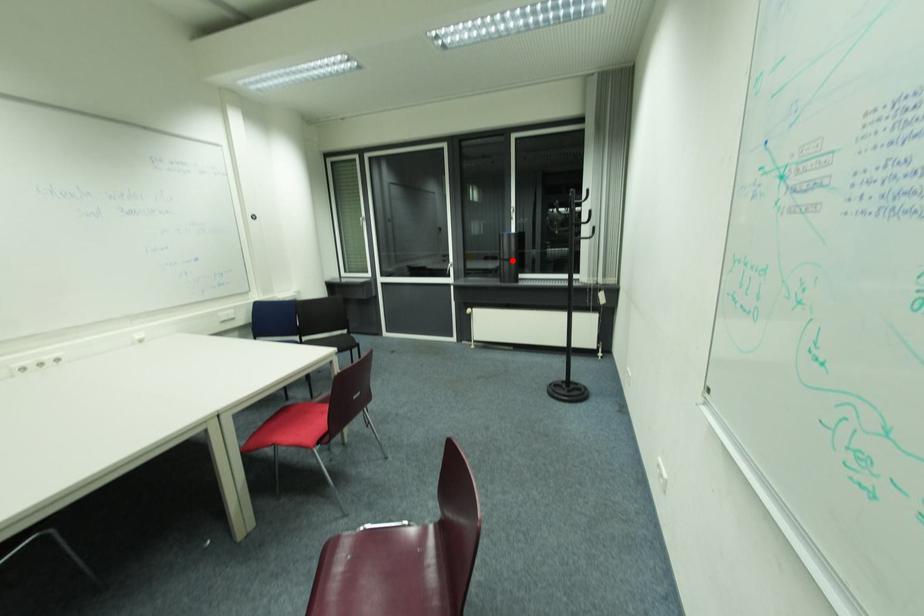
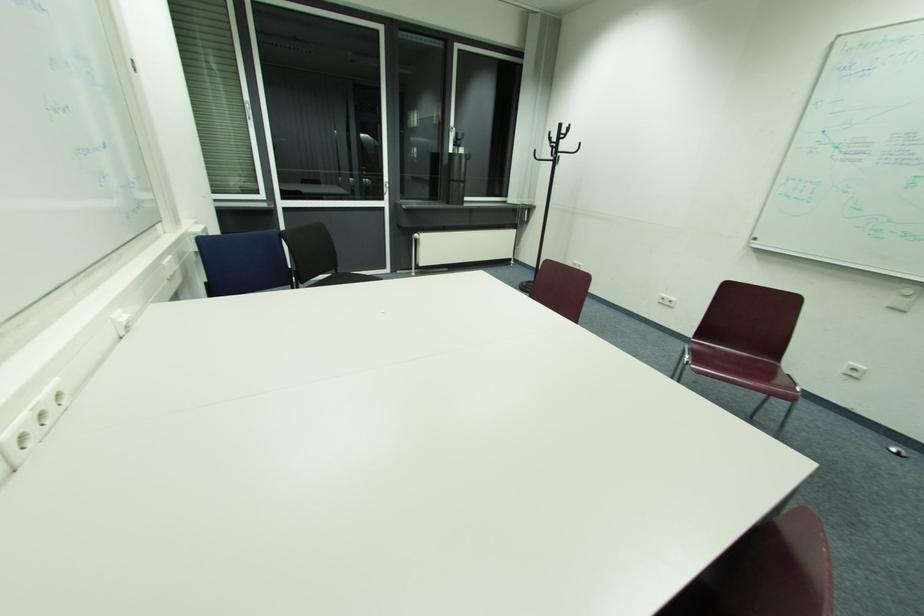
Question: I am providing you with two images of the same scene from different viewpoints. A red point is shown in image1. For the corresponding object point in image2, is it positioned nearer or farther from the camera?

Choices:
 (A) Nearer
 (B) Farther

Answer: (A)